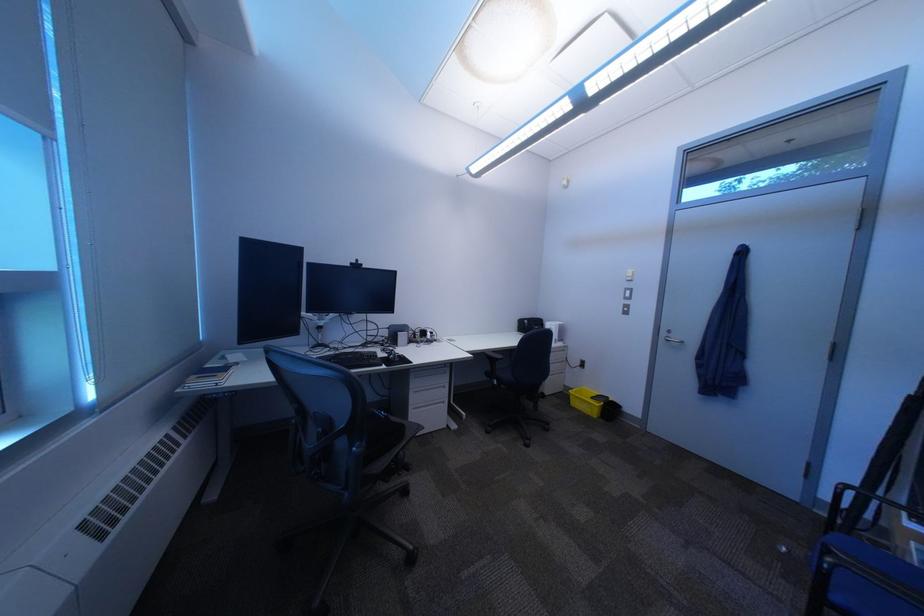
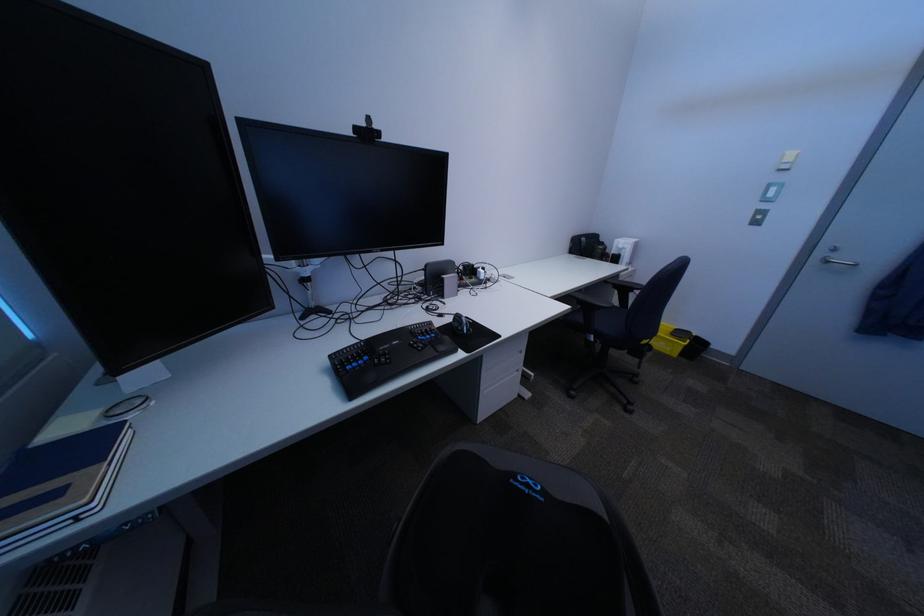
Find the pixel in the second image that matches [396,355] in the first image.

(454, 325)